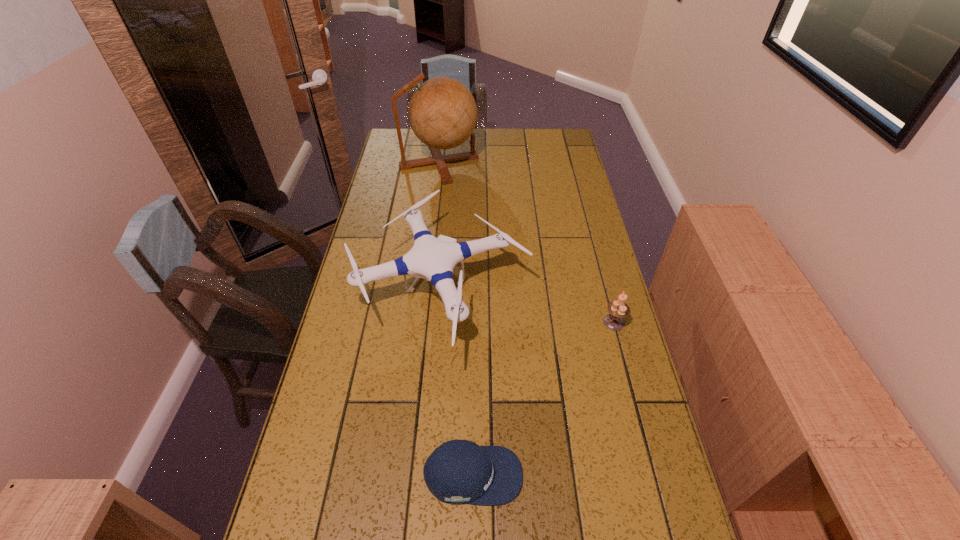
Identify the location of empty space between the third shortest object and the shortest object. The height and width of the screenshot is (540, 960). (457, 383).

In order to click on vacant area that lies between the second tallest object and the globe in this screenshot , I will do `click(440, 227)`.

Identify the location of object that is the second nearest to the third shortest object. (618, 309).

Identify which object is located as the second nearest to the globe. Please provide its 2D coordinates. Your answer should be formatted as a tuple, i.e. [(x, y)], where the tuple contains the x and y coordinates of a point satisfying the conditions above.

[(618, 309)]

Where is `free spot that satisfies the following two spatial constraints: 1. on the surface of the tallest object; 2. on the left side of the drone`? The image size is (960, 540). free spot that satisfies the following two spatial constraints: 1. on the surface of the tallest object; 2. on the left side of the drone is located at coordinates (423, 292).

Image resolution: width=960 pixels, height=540 pixels. What are the coordinates of `vacant space that satisfies the following two spatial constraints: 1. on the front side of the rightmost object; 2. on the front-facing side of the shortest object` in the screenshot? It's located at (655, 475).

Locate an element on the screen. Image resolution: width=960 pixels, height=540 pixels. vacant space that satisfies the following two spatial constraints: 1. on the back side of the drone; 2. on the surface of the globe is located at coordinates pos(451,163).